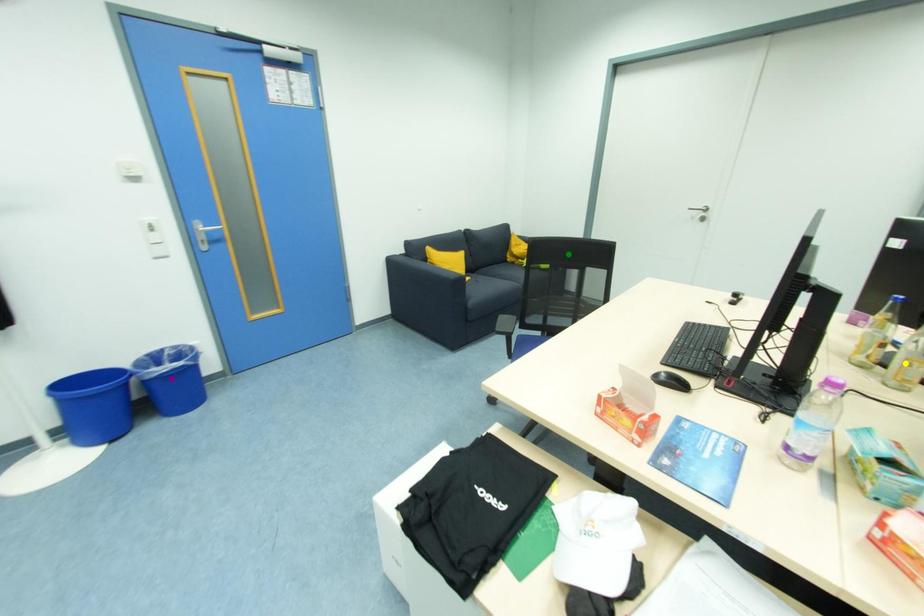
Based on the photo, order these from nearest to farthest:
- purple point
- green point
- yellow point

yellow point < purple point < green point